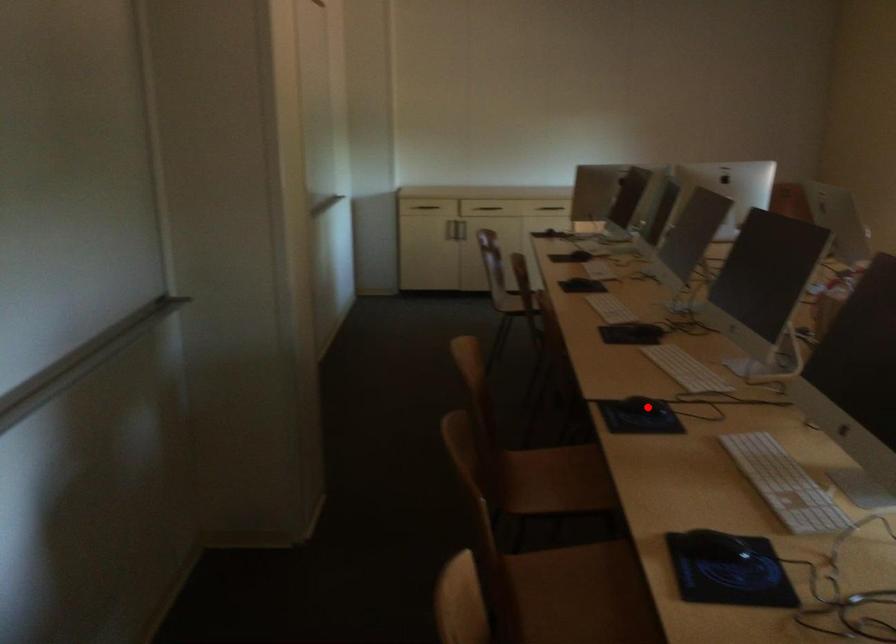
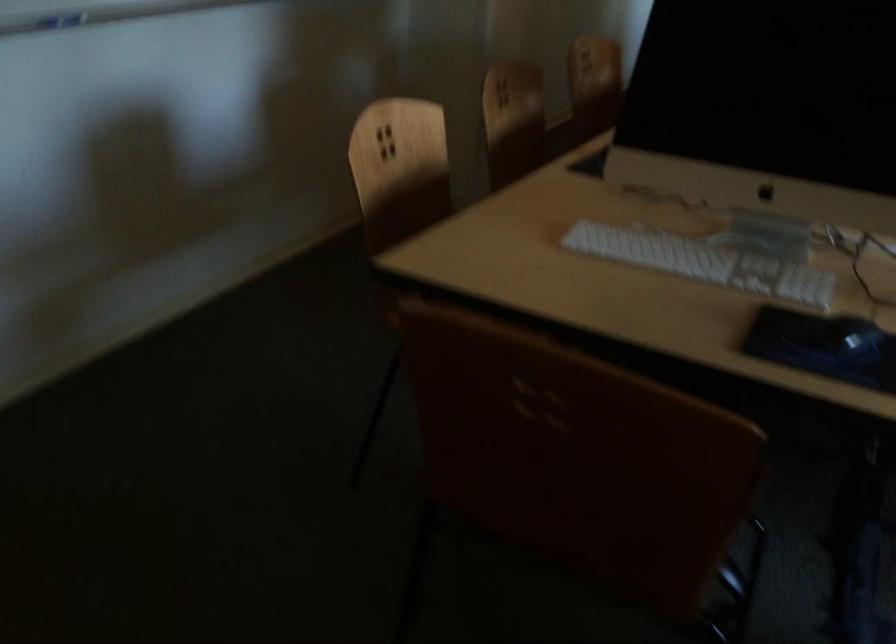
Question: I am providing you with two images of the same scene from different viewpoints. A red point is marked on the first image. Can you still see the location of the red point in image 2?

Choices:
 (A) Yes
 (B) No

Answer: (B)